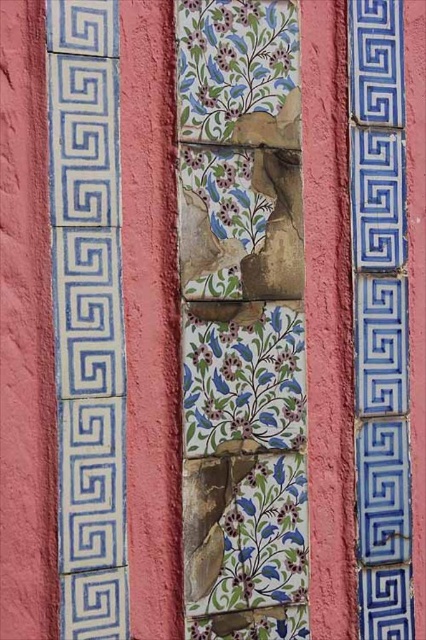
Question: Which object is positioned closest to the blue glossy tile at right?

Choices:
 (A) blue glossy tile at left
 (B) floral painted tiles at center

Answer: (B)

Question: Is blue glossy tile at left to the right of blue glossy tile at right from the viewer's perspective?

Choices:
 (A) yes
 (B) no

Answer: (B)

Question: Which point is closer to the camera?

Choices:
 (A) (94, 592)
 (B) (411, 612)

Answer: (A)

Question: Can you confirm if floral painted tiles at center is positioned to the left of blue glossy tile at left?

Choices:
 (A) yes
 (B) no

Answer: (B)

Question: Is floral painted tiles at center further to camera compared to blue glossy tile at right?

Choices:
 (A) no
 (B) yes

Answer: (A)

Question: Which point appears farthest from the camera in this image?

Choices:
 (A) (207, 182)
 (B) (77, 472)
 (C) (370, 288)

Answer: (C)